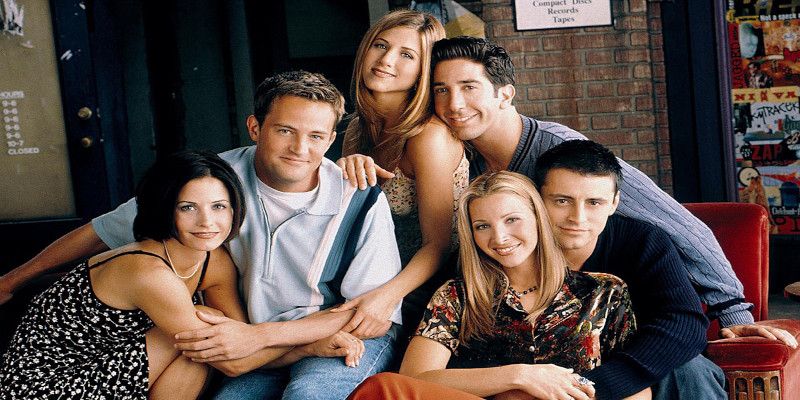
The image size is (800, 400). What are the coordinates of `posters` in the screenshot? It's located at (781, 120), (778, 38).